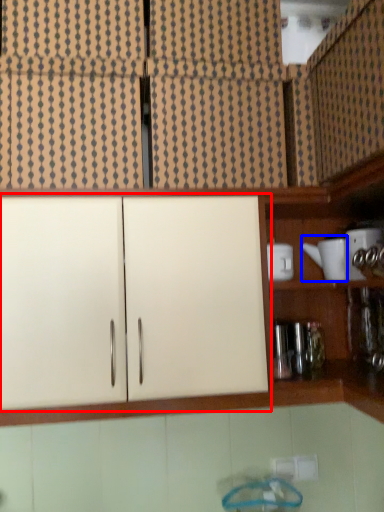
Question: Among these objects, which one is nearest to the camera, cabinetry (highlighted by a red box) or appliance (highlighted by a blue box)?

Choices:
 (A) cabinetry
 (B) appliance

Answer: (A)